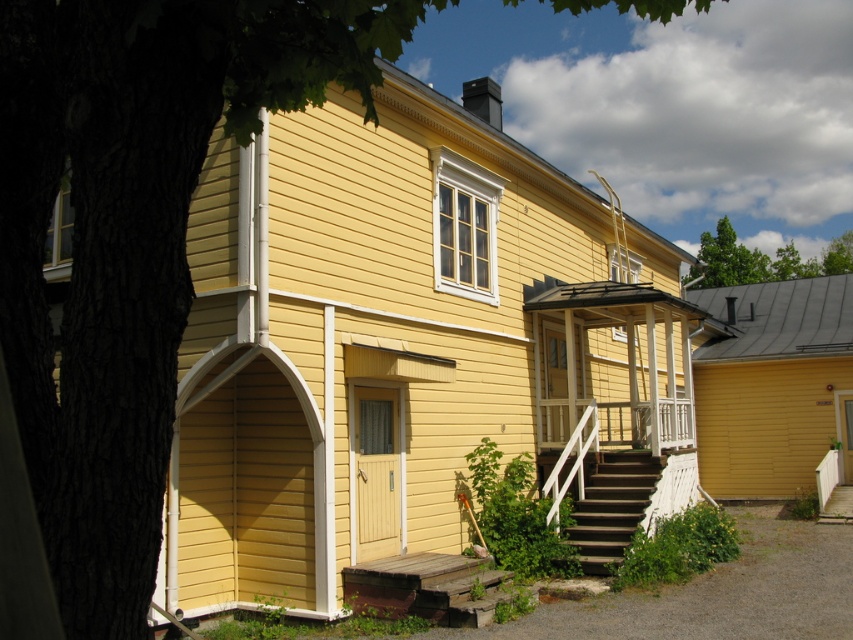
Can you confirm if dark brown wooden stairs at lower center is wider than green leafy tree at upper center?

No, dark brown wooden stairs at lower center is not wider than green leafy tree at upper center.

Is point (647, 493) behind point (846, 269)?

That is False.

Find the location of `dark brown wooden stairs at lower center`. dark brown wooden stairs at lower center is located at coordinates (612, 506).